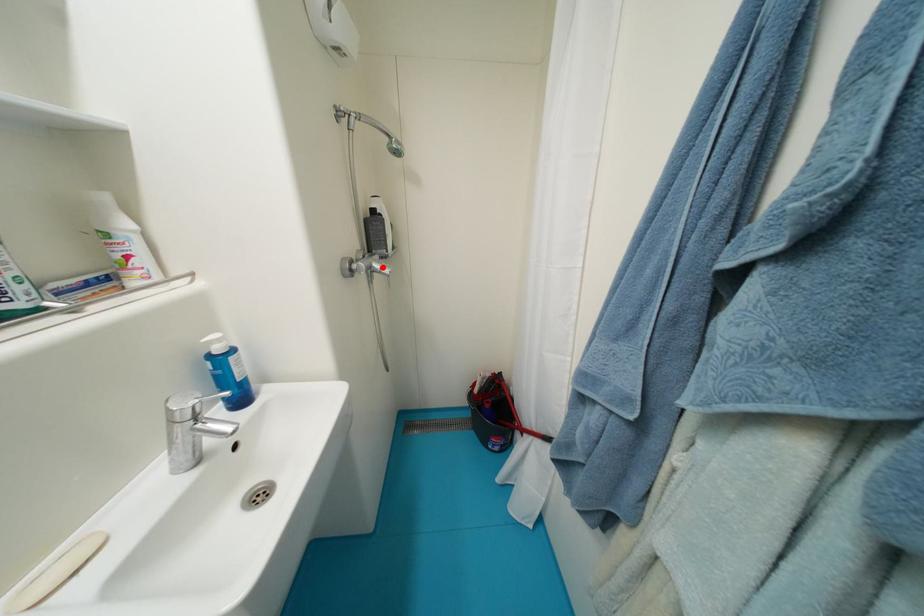
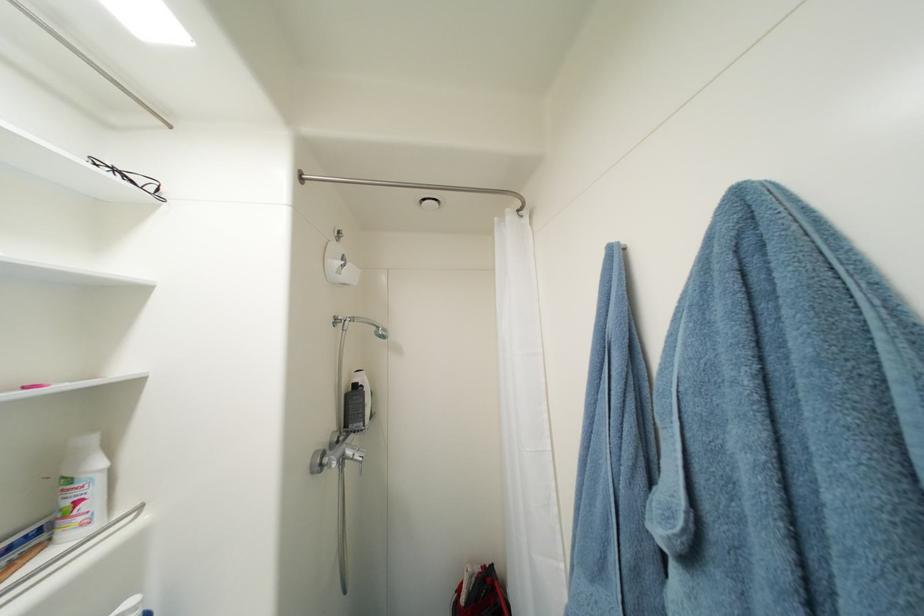
Where in the second image is the point corresponding to the highlighted location from the first image?

(356, 454)